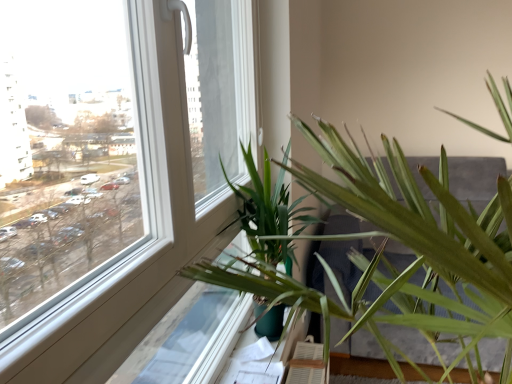
Measure the distance between point (287, 343) and camera.

1.74 meters.

What do you see at coordinates (409, 247) in the screenshot? I see `green matte plant at lower center` at bounding box center [409, 247].

The image size is (512, 384). Identify the location of green leafy palm at center. click(x=268, y=213).

Where is `green plastic at lower center`? green plastic at lower center is located at coordinates (265, 358).

In terms of width, does green matte plant at lower center look wider or thinner when compared to green leafy palm at center?

In the image, green matte plant at lower center appears to be wider than green leafy palm at center.

Which object is positioned more to the right, green matte plant at lower center or green leafy palm at center?

green matte plant at lower center is more to the right.

Can you confirm if green matte plant at lower center is smaller than green leafy palm at center?

Actually, green matte plant at lower center might be larger than green leafy palm at center.

From the image's perspective, which is below, green matte plant at lower center or green plastic at lower center?

green plastic at lower center.

Are green matte plant at lower center and green plastic at lower center far apart?

No, there isn't a large distance between green matte plant at lower center and green plastic at lower center.

Considering the relative sizes of green matte plant at lower center and green plastic at lower center in the image provided, is green matte plant at lower center thinner than green plastic at lower center?

No, green matte plant at lower center is not thinner than green plastic at lower center.

Considering the sizes of green matte plant at lower center and green plastic at lower center in the image, is green matte plant at lower center taller or shorter than green plastic at lower center?

green matte plant at lower center is taller than green plastic at lower center.

Do you think green leafy palm at center is within green plastic at lower center, or outside of it?

green leafy palm at center lies outside green plastic at lower center.

Can you confirm if green leafy palm at center is shorter than green plastic at lower center?

Incorrect, the height of green leafy palm at center does not fall short of that of green plastic at lower center.

From the image's perspective, which one is positioned lower, green leafy palm at center or green plastic at lower center?

green plastic at lower center is shown below in the image.

In the scene shown: How different are the orientations of green plastic at lower center and green matte plant at lower center in degrees?

The facing directions of green plastic at lower center and green matte plant at lower center are 1.19 degrees apart.

Which point is more distant from viewer, [276,359] or [510,194]?

The point [276,359] is more distant.

Does green plastic at lower center have a greater width compared to green matte plant at lower center?

No.

From the image's perspective, which one is positioned higher, green plastic at lower center or green matte plant at lower center?

From the image's view, green matte plant at lower center is above.

Based on the photo, is green matte plant at lower center at the back of green leafy palm at center?

Yes, green matte plant at lower center is at the back of green leafy palm at center.

Which of these two, green leafy palm at center or green matte plant at lower center, is bigger?

green matte plant at lower center.

Is green leafy palm at center positioned beyond the bounds of green matte plant at lower center?

No, green leafy palm at center is not outside of green matte plant at lower center.

Is point (287, 273) farther from viewer compared to point (371, 186)?

Yes, point (287, 273) is farther from viewer.

Which is more to the left, green plastic at lower center or green leafy palm at center?

green plastic at lower center is more to the left.

From the image's perspective, is green plastic at lower center located above green leafy palm at center?

No, from the image's perspective, green plastic at lower center is not over green leafy palm at center.

Considering the sizes of objects green plastic at lower center and green leafy palm at center in the image provided, who is taller, green plastic at lower center or green leafy palm at center?

green leafy palm at center.

Is green plastic at lower center outside of green leafy palm at center?

green plastic at lower center is positioned outside green leafy palm at center.

In the image, there is a green leafy palm at center. At what (x,y) coordinates should I click in order to perform the action: click on houseplant below it (from a real-world perspective). Please return your answer as a coordinate pair (x, y). Image resolution: width=512 pixels, height=384 pixels. Looking at the image, I should click on (409, 247).

You are a GUI agent. You are given a task and a screenshot of the screen. Output one action in this format:
    pyautogui.click(x=<x>, y=<y>)
    Task: Click on the window sill behind the green matte plant at lower center
    Image resolution: width=512 pixels, height=384 pixels.
    Given the screenshot: What is the action you would take?
    pyautogui.click(x=265, y=358)

Based on their spatial positions, is green leafy palm at center or green matte plant at lower center further from green plastic at lower center?

The object further to green plastic at lower center is green matte plant at lower center.

Looking at this image, looking at the image, which one is located further to green leafy palm at center, green matte plant at lower center or green plastic at lower center?

green plastic at lower center is further to green leafy palm at center.

From the image, which object appears to be nearer to green matte plant at lower center, green plastic at lower center or green leafy palm at center?

Among the two, green leafy palm at center is located nearer to green matte plant at lower center.

Looking at the image, which one is located closer to green leafy palm at center, green plastic at lower center or green matte plant at lower center?

green matte plant at lower center.

When comparing their distances from green plastic at lower center, does green matte plant at lower center or green leafy palm at center seem further?

The object further to green plastic at lower center is green matte plant at lower center.

Estimate the real-world distances between objects in this image. Which object is further from green matte plant at lower center, green leafy palm at center or green plastic at lower center?

green plastic at lower center.

I want to click on palm tree between green matte plant at lower center and green plastic at lower center from front to back, so click(x=268, y=213).